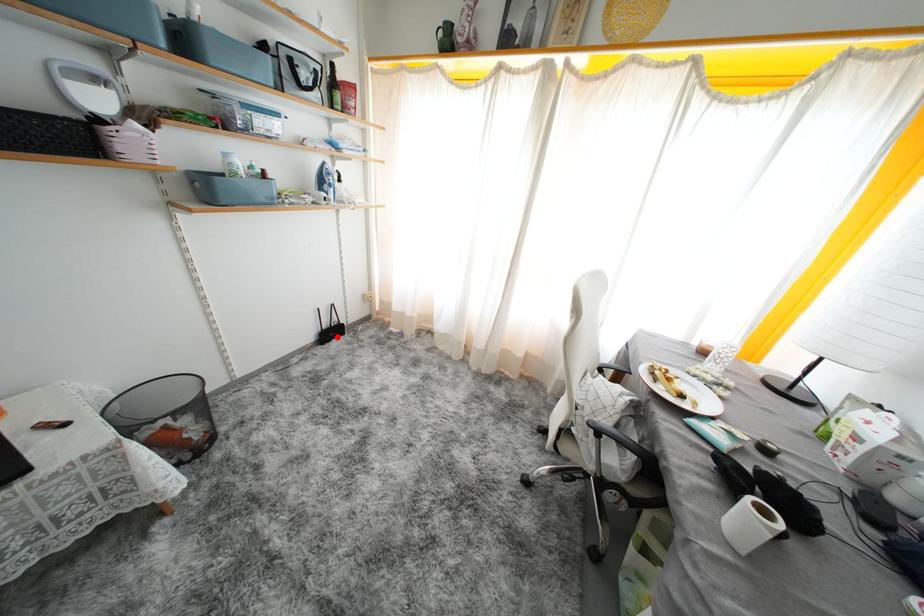
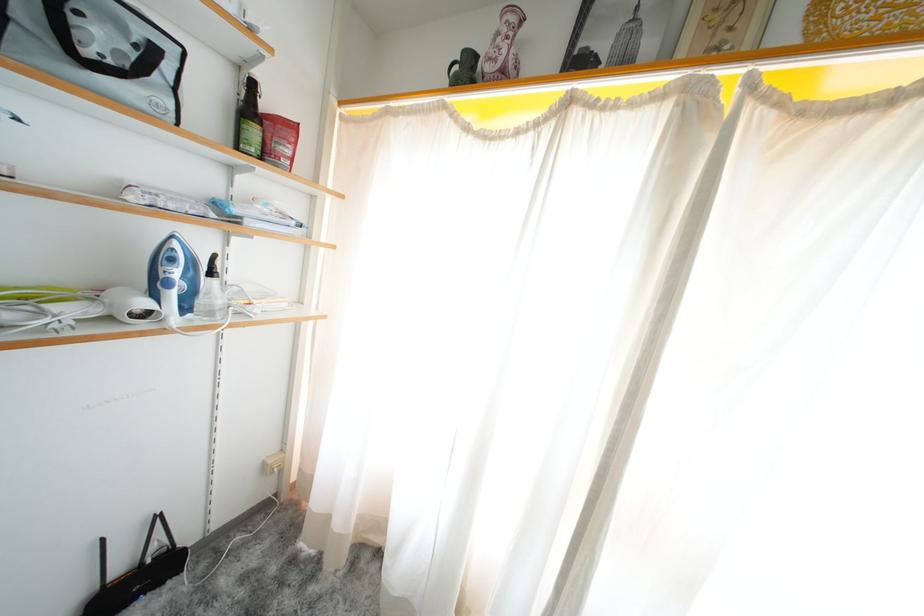
Find the pixel in the second image that matches the highlighted location in the first image.

(143, 586)